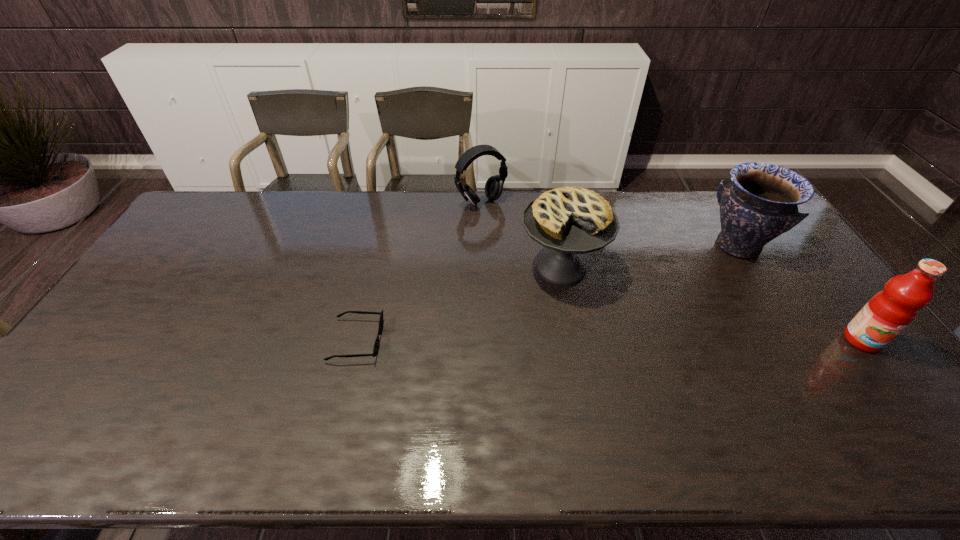
Identify the location of fruit juice at the right edge. This screenshot has height=540, width=960. (891, 310).

Find the location of a particular element. This screenshot has width=960, height=540. pottery situated at the right edge is located at coordinates (762, 202).

At what (x,y) coordinates should I click in order to perform the action: click on object that is at the far right corner. Please return your answer as a coordinate pair (x, y). Looking at the image, I should click on (762, 202).

Where is `vacant space at the far edge`? The width and height of the screenshot is (960, 540). vacant space at the far edge is located at coordinates (292, 211).

The width and height of the screenshot is (960, 540). Find the location of `vacant space at the near edge of the desktop`. vacant space at the near edge of the desktop is located at coordinates pos(801,404).

Locate an element on the screen. This screenshot has height=540, width=960. free space at the left edge of the desktop is located at coordinates (148, 279).

Find the location of a particular element. Image resolution: width=960 pixels, height=540 pixels. vacant area at the right edge of the desktop is located at coordinates (848, 366).

Locate an element on the screen. Image resolution: width=960 pixels, height=540 pixels. vacant space at the far left corner of the desktop is located at coordinates (227, 224).

The image size is (960, 540). Identify the location of unoccupied position between the rightmost object and the pie. (711, 304).

Identify the location of empty space between the rightmost object and the earphone. This screenshot has width=960, height=540. (672, 271).